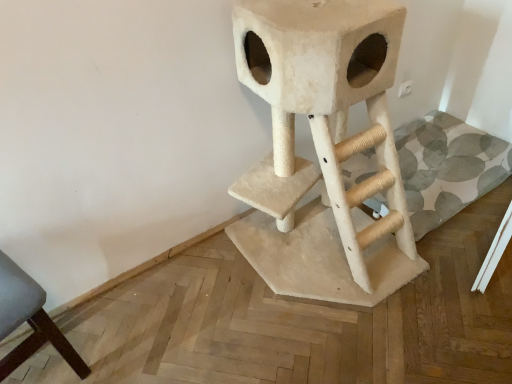
This screenshot has width=512, height=384. I want to click on free space that is to the left of beige carpeted cat tree at center, so click(193, 302).